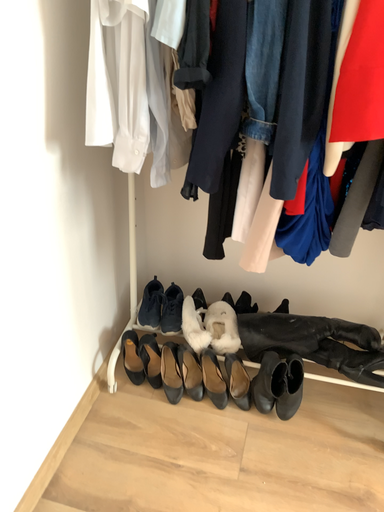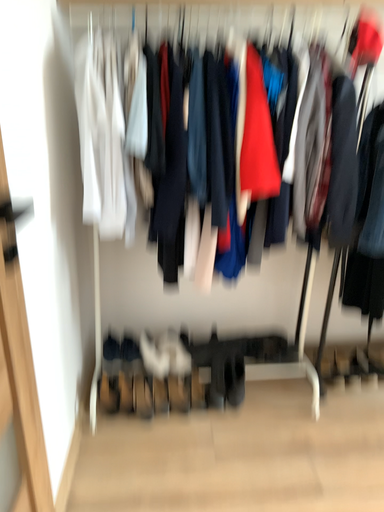
Question: Which way did the camera rotate in the video?

Choices:
 (A) rotated left
 (B) rotated right

Answer: (B)